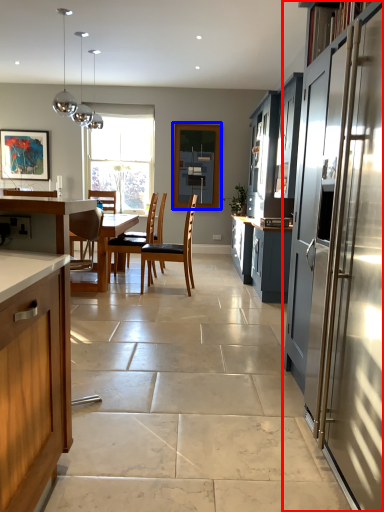
Question: Among these objects, which one is nearest to the camera, cabinetry (highlighted by a red box) or window screen (highlighted by a blue box)?

Choices:
 (A) cabinetry
 (B) window screen

Answer: (A)